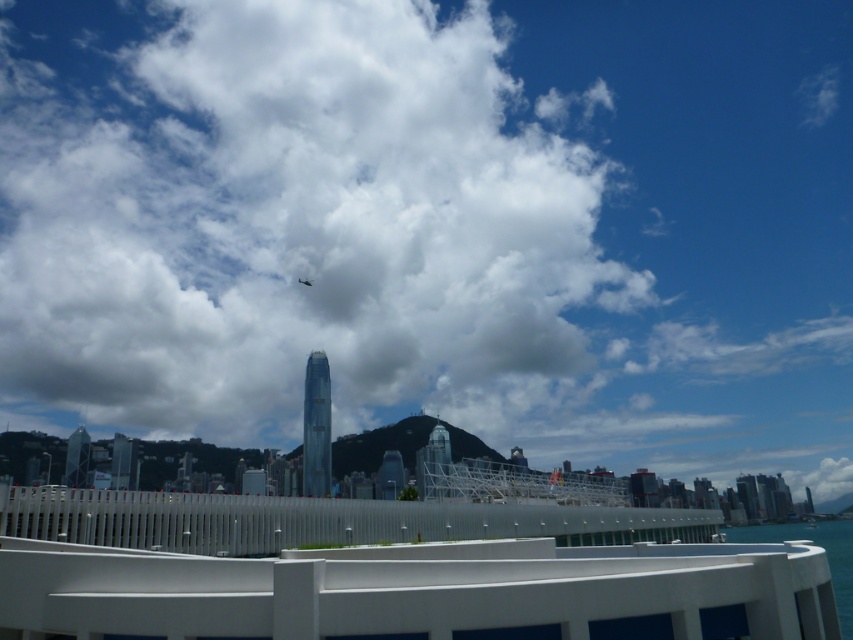
You are standing at the curved white railing in the foreground of the urban landscape. You notice two points marked in the scene. Which point, point [515,508] or point [846,584], is closer to you?

Point [846,584] is closer to you because it is in front of point [515,508] according to the spatial relationship provided.

You are an architect designing a new observation deck. You need to ensure that the view from the deck includes both the white fluffy cloud at upper center and the blue water at lower right. Given their sizes, which one will occupy more of the viewer s field of vision?

The white fluffy cloud at upper center will occupy more of the viewer s field of vision because its width surpasses that of the blue water at lower right.

You are a tourist standing on the silver metallic rail at center, looking down. Can you see the blue water at lower right from your current position?

Yes, the silver metallic rail at center is above the blue water at lower right, so you can see it from your current position.